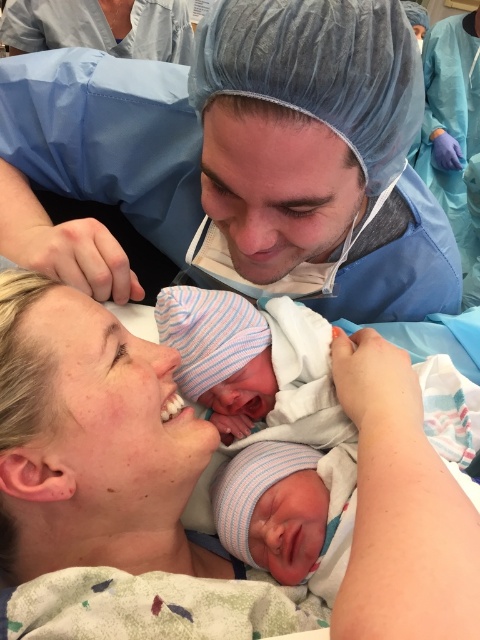
You are a photographer positioned in front of the hospital room scene. You want to capture a closeup of the baby while ensuring both parents are visible in the background. Which point, point (140, 218) or point (196, 320), should you focus on to achieve this?

You should focus on point (140, 218) because it is closer to the viewer than point (196, 320). Focusing on this point will allow the baby to be in sharp closeup while keeping the parents in the background visible.